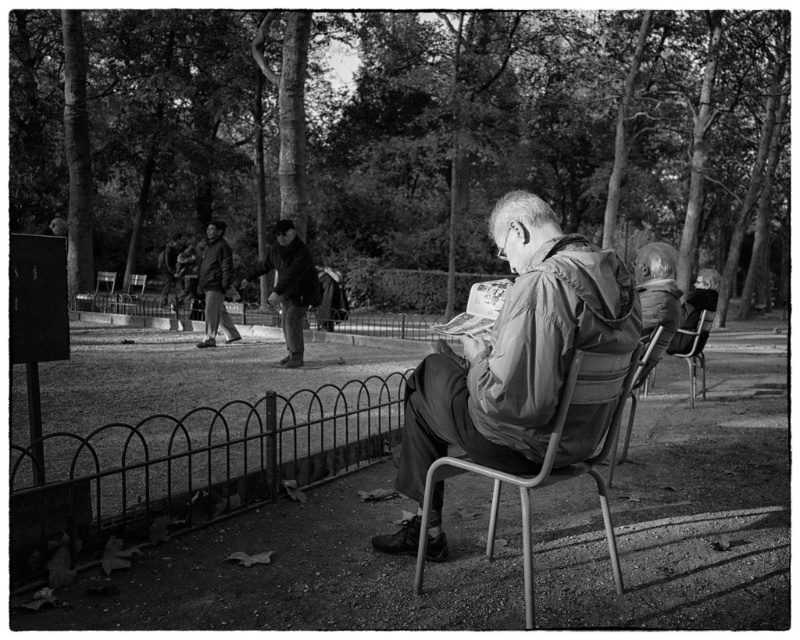
Between metallic gray chair at center and metallic silver chair at center, which one appears on the right side from the viewer's perspective?

Positioned to the right is metallic gray chair at center.

How much distance is there between metallic gray chair at center and metallic silver chair at center?

metallic gray chair at center is 46.81 feet away from metallic silver chair at center.

This screenshot has width=800, height=640. What are the coordinates of `metallic gray chair at center` in the screenshot? It's located at (638, 387).

Locate an element on the screen. The width and height of the screenshot is (800, 640). metallic gray chair at center is located at coordinates (638, 387).

Is metallic silver chair at lower left behind metallic silver chair at center?

Yes, it is behind metallic silver chair at center.

Describe the element at coordinates (97, 292) in the screenshot. The width and height of the screenshot is (800, 640). I see `metallic silver chair at lower left` at that location.

Find the location of a particular element. metallic silver chair at lower left is located at coordinates (97, 292).

Can you confirm if matte gray jacket at center is positioned to the left of metallic gray folding chair at center?

Yes, matte gray jacket at center is to the left of metallic gray folding chair at center.

Which is more to the right, matte gray jacket at center or metallic gray folding chair at center?

From the viewer's perspective, metallic gray folding chair at center appears more on the right side.

I want to click on matte gray jacket at center, so click(517, 349).

You are a GUI agent. You are given a task and a screenshot of the screen. Output one action in this format:
    pyautogui.click(x=<x>, y=<y>)
    Task: Click on the matte gray jacket at center
    The height and width of the screenshot is (640, 800).
    Given the screenshot: What is the action you would take?
    pyautogui.click(x=517, y=349)